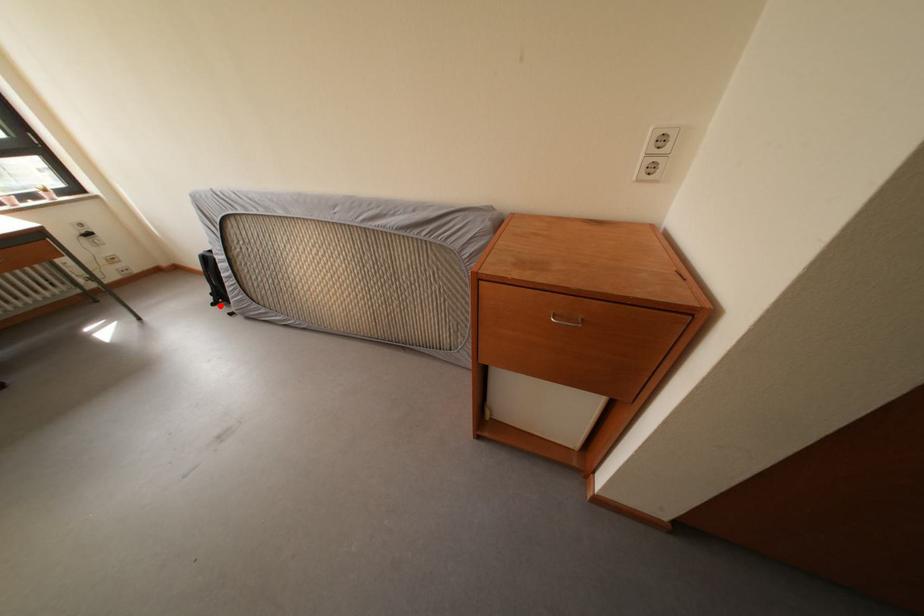
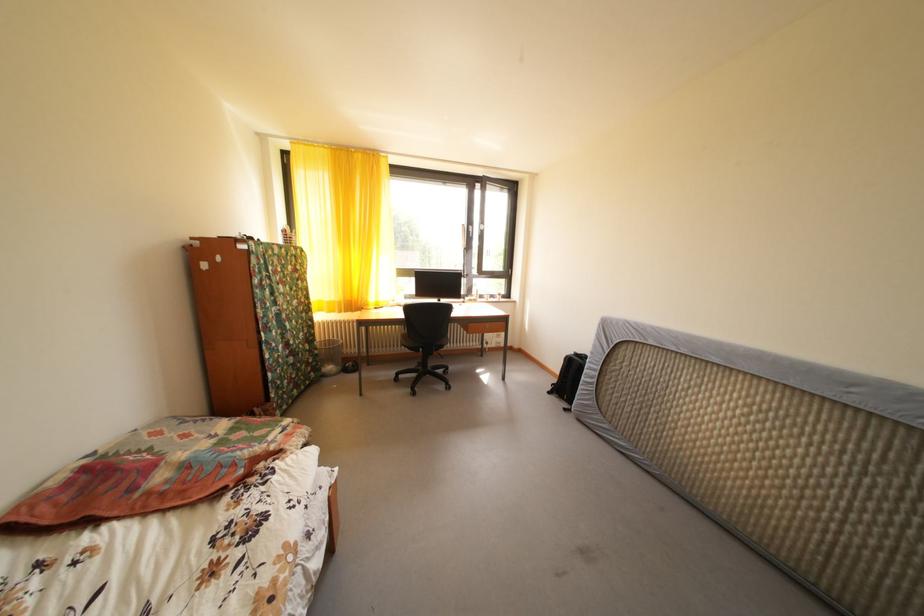
Question: I am providing you with two images of the same scene from different viewpoints. In image1, a red point is highlighted. Considering the same 3D point in image2, which of the following is correct?

Choices:
 (A) It is closer
 (B) It is farther

Answer: (A)